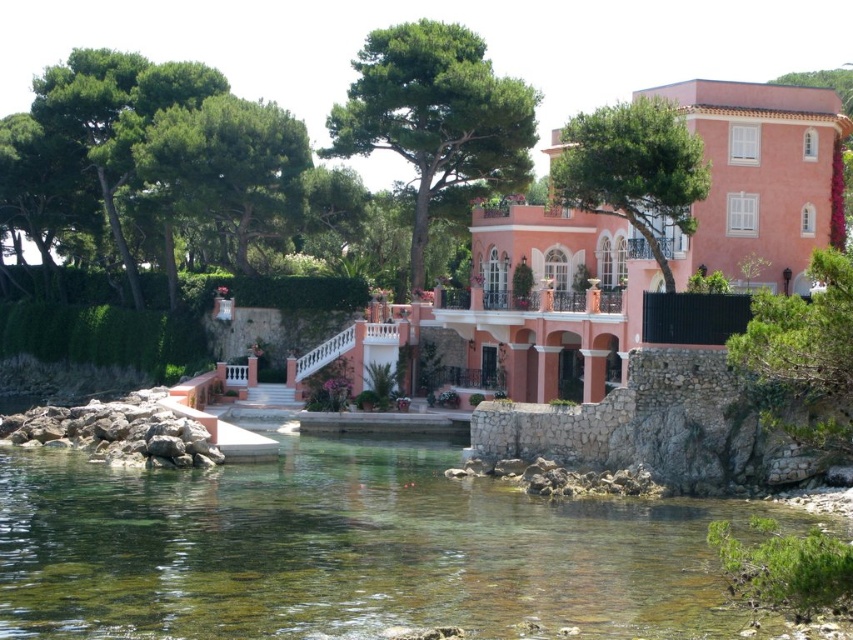
Question: Is pink stucco villa at center closer to the viewer compared to green leafy tree at center?

Choices:
 (A) yes
 (B) no

Answer: (A)

Question: Among these objects, which one is nearest to the camera?

Choices:
 (A) green leafy tree at upper left
 (B) green leafy tree at center
 (C) pink stucco villa at center

Answer: (C)

Question: Which object appears closest to the camera in this image?

Choices:
 (A) green leafy tree at upper left
 (B) clear water at lower center
 (C) green textured tree at right

Answer: (C)

Question: Can you confirm if pink stucco villa at center is thinner than green leafy tree at upper right?

Choices:
 (A) yes
 (B) no

Answer: (A)

Question: Considering the real-world distances, which object is farthest from the clear water at lower center?

Choices:
 (A) green leafy tree at upper right
 (B) green textured tree at right
 (C) green leafy tree at upper left

Answer: (A)

Question: Does green leafy tree at upper left have a greater width compared to green leafy tree at upper right?

Choices:
 (A) no
 (B) yes

Answer: (B)